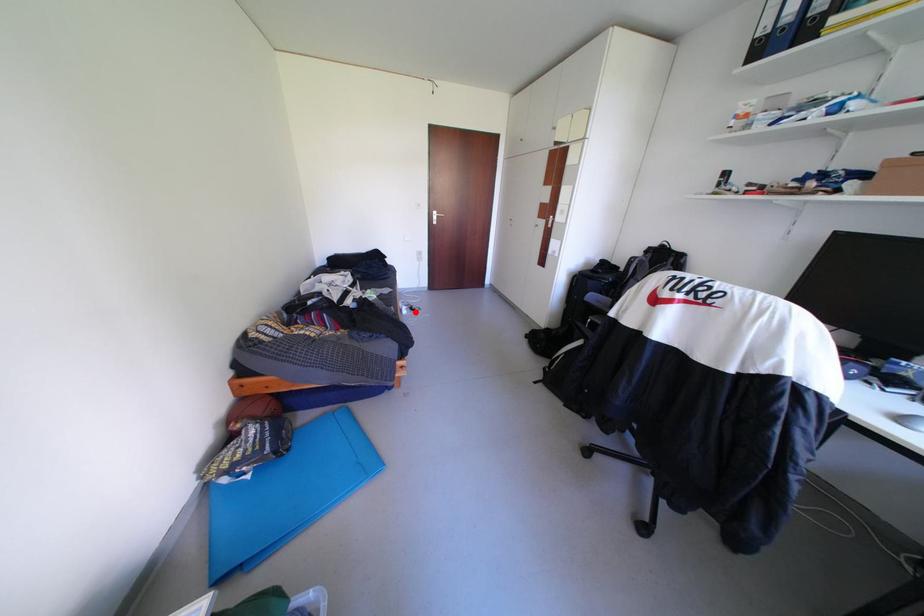
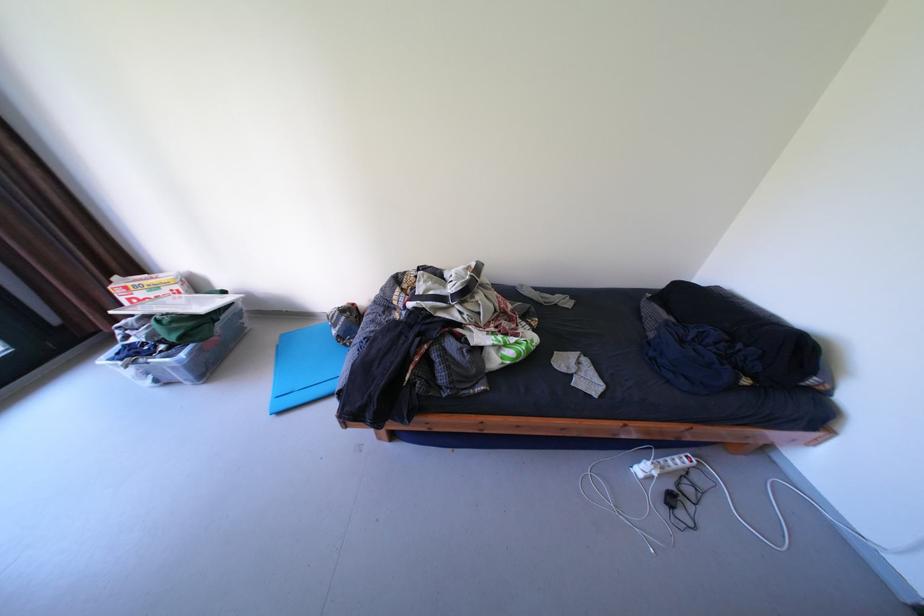
Question: I am providing you with two images of the same scene from different viewpoints. Given a red point in image1, look at the same physical point in image2. Is it:

Choices:
 (A) Closer to the viewpoint
 (B) Farther from the viewpoint

Answer: (B)